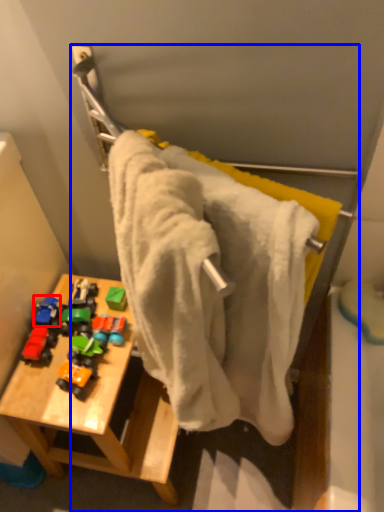
Question: Among these objects, which one is nearest to the camera, toy (highlighted by a red box) or towel rack (highlighted by a blue box)?

Choices:
 (A) toy
 (B) towel rack

Answer: (B)